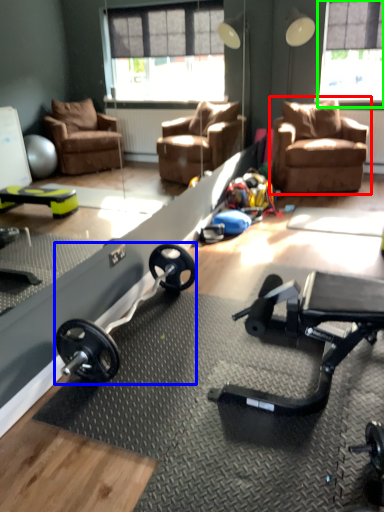
Question: Which object is positioned closest to chair (highlighted by a red box)? Select from barbell (highlighted by a blue box) and window screen (highlighted by a green box).

Choices:
 (A) barbell
 (B) window screen

Answer: (B)